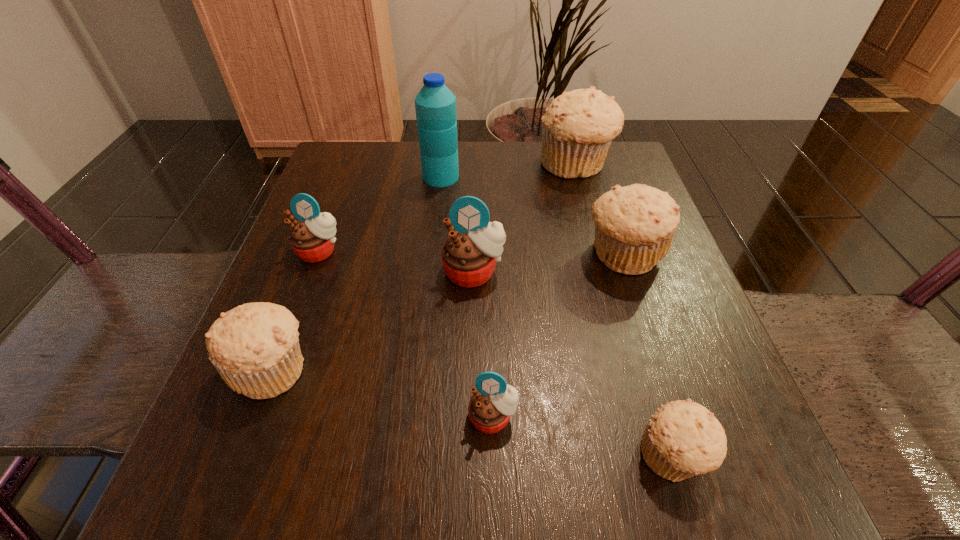
In the image, there is a desktop. In order to click on vacant space at the far right corner in this screenshot , I will do `click(630, 165)`.

Image resolution: width=960 pixels, height=540 pixels. In order to click on vacant space at the near right corner in this screenshot , I will do `click(700, 478)`.

The image size is (960, 540). What are the coordinates of `vacant space that is in between the biggest pink muffin and the farthest muffin` in the screenshot? It's located at (524, 218).

Locate an element on the screen. This screenshot has width=960, height=540. empty space that is in between the biggest pink muffin and the nearest beige muffin is located at coordinates (573, 364).

Find the location of a particular element. Image resolution: width=960 pixels, height=540 pixels. free space between the smallest beige muffin and the second biggest beige muffin is located at coordinates (648, 355).

The width and height of the screenshot is (960, 540). Identify the location of vacant area between the biggest pink muffin and the nearest pink muffin. (483, 345).

Locate an element on the screen. vacant space in between the leftmost pink muffin and the second smallest beige muffin is located at coordinates [296, 309].

Find the location of a particular element. free point between the biggest pink muffin and the biggest beige muffin is located at coordinates (524, 218).

The image size is (960, 540). In order to click on empty space that is in between the nearest pink muffin and the second biggest pink muffin in this screenshot , I will do `click(406, 334)`.

At what (x,y) coordinates should I click in order to perform the action: click on object that is the fourth nearest to the second nearest beige muffin. Please return your answer as a coordinate pair (x, y). The image size is (960, 540). Looking at the image, I should click on (435, 105).